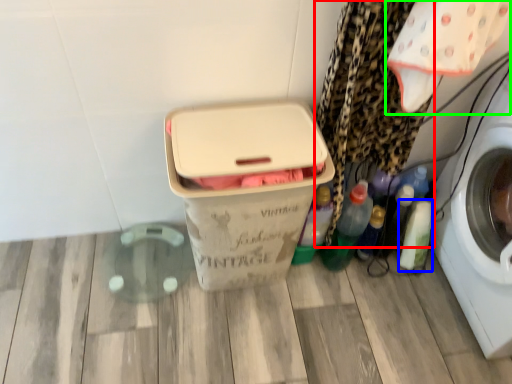
Question: Estimate the real-world distances between objects in this image. Which object is farther from curtain (highlighted by a red box), bottle (highlighted by a blue box) or baby clothe (highlighted by a green box)?

Choices:
 (A) bottle
 (B) baby clothe

Answer: (A)